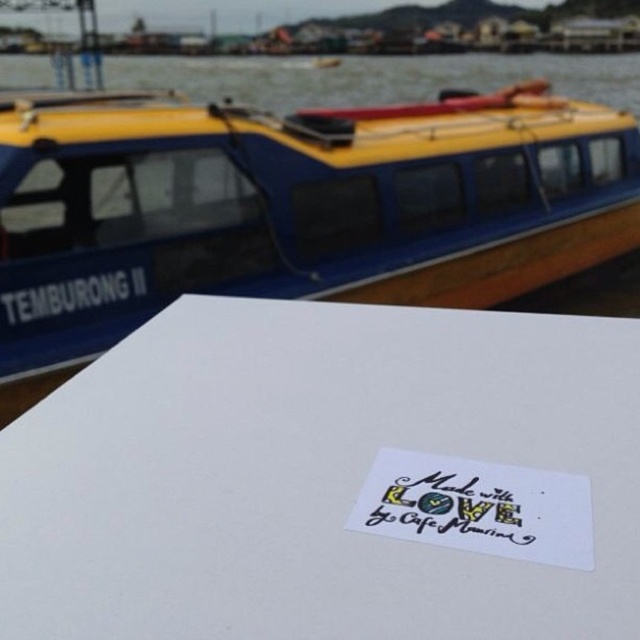
You are a customer at Cafe Mawin and want to take a photo of the white paper at lower center and the yellow matte boat at upper left in the background. Which object should you focus on first to ensure both are in focus?

The white paper at lower center is below the yellow matte boat at upper left, so you should focus on the yellow matte boat at upper left first to ensure both are in focus.

You are designing a layout for a promotional poster. The poster must include both the white paper at lower center and the yellow matte boat at upper left. Based on their sizes, which object should be placed closer to the bottom of the poster to maintain visual balance?

The white paper at lower center is shorter than the yellow matte boat at upper left, so to maintain visual balance, the shorter white paper at lower center should be placed closer to the bottom of the poster while the taller yellow matte boat at upper left can be positioned higher up.